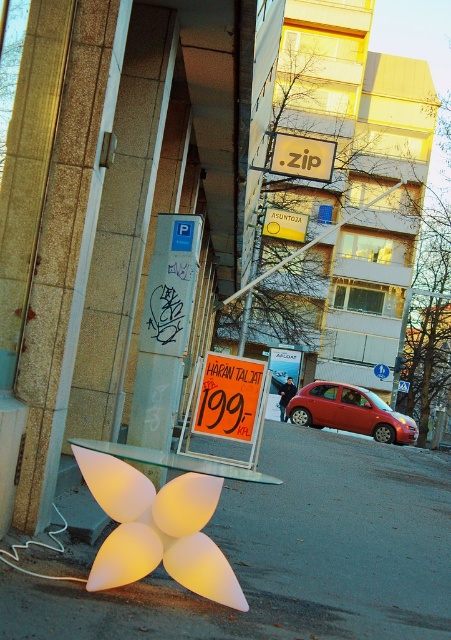
Question: Among these objects, which one is nearest to the camera?

Choices:
 (A) shiny red car at center
 (B) translucent plastic flower at lower center
 (C) yellow paper at center
 (D) white paper sign at center

Answer: (B)

Question: Is translucent plastic flower at lower center to the right of yellow paper at center from the viewer's perspective?

Choices:
 (A) no
 (B) yes

Answer: (A)

Question: Which of the following is the farthest from the observer?

Choices:
 (A) (331, 401)
 (B) (99, 465)

Answer: (A)

Question: Which object is closer to the camera taking this photo?

Choices:
 (A) translucent plastic flower at lower center
 (B) yellow paper at center
 (C) yellow matte sign at upper center
 (D) shiny red car at center

Answer: (A)

Question: Does white paper sign at center appear over yellow paper at center?

Choices:
 (A) yes
 (B) no

Answer: (B)

Question: Is translucent plastic flower at lower center thinner than shiny red car at center?

Choices:
 (A) yes
 (B) no

Answer: (B)